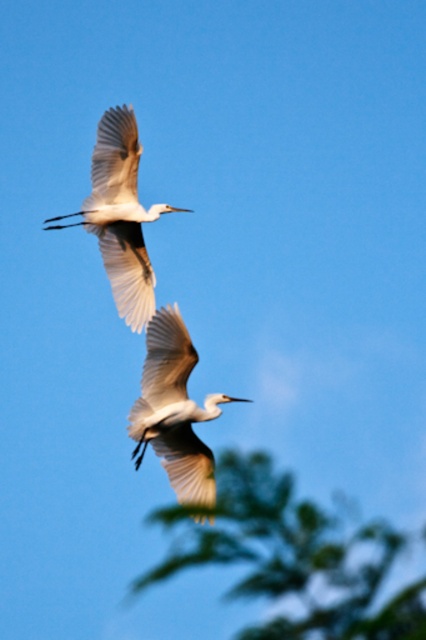
You are a birdwatcher observing the scene. You notice the green leafy tree at lower center and the white matte bird at center. Which object is positioned to the right of the other?

The green leafy tree at lower center is to the right of the white matte bird at center.

You are a birdwatcher observing the scene. You notice the green leafy tree at lower center and the white matte bird at center. Which object is taller in the image?

The green leafy tree at lower center is much taller than the white matte bird at center.